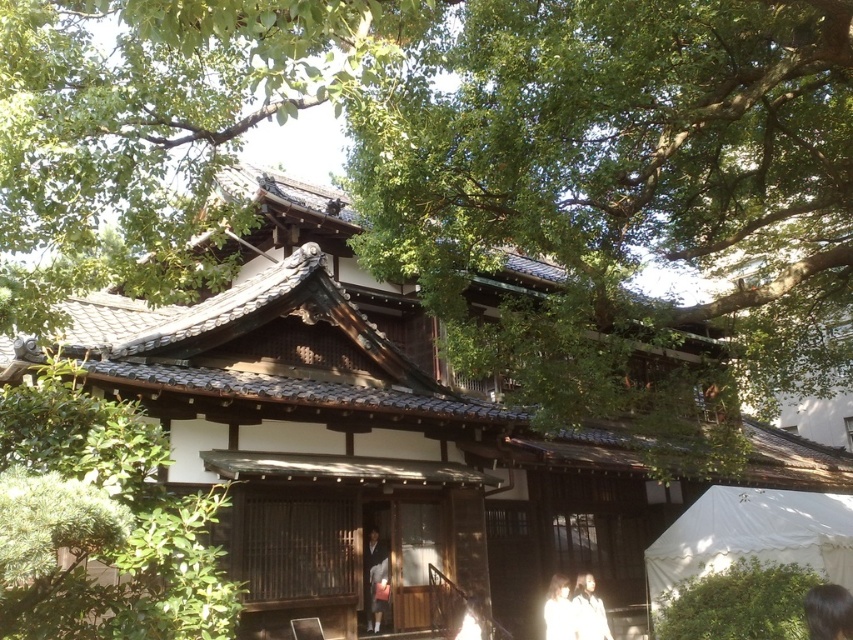
Question: Which object is farther from the camera taking this photo?

Choices:
 (A) white canvas canopy at lower right
 (B) green leafy tree at center

Answer: (A)

Question: Does matte black kimono at center have a smaller size compared to white cotton shirt at lower center?

Choices:
 (A) no
 (B) yes

Answer: (A)

Question: Is white canvas canopy at lower right closer to the viewer compared to dark brown hair at lower right?

Choices:
 (A) yes
 (B) no

Answer: (B)

Question: Which point is closer to the camera?

Choices:
 (A) matte black kimono at center
 (B) green leafy tree at upper center
 (C) white matte jacket at lower right
 (D) white cotton shirt at lower center

Answer: (B)

Question: Does white matte jacket at lower right come behind white cotton shirt at lower center?

Choices:
 (A) no
 (B) yes

Answer: (B)

Question: Which is nearer to the green leafy tree at center?

Choices:
 (A) white fabric person at lower right
 (B) white cotton shirt at lower center
 (C) green leafy tree at upper center
 (D) matte black kimono at center

Answer: (C)